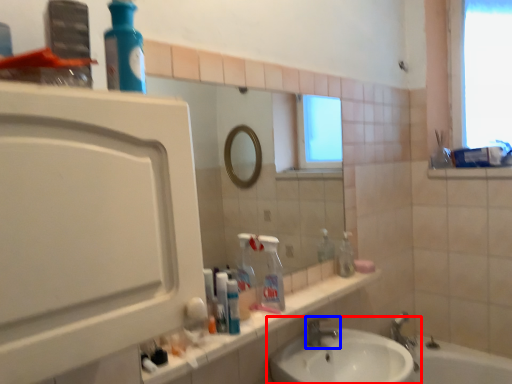
Question: Which of the following is the closest to the observer, sink (highlighted by a red box) or tap (highlighted by a blue box)?

Choices:
 (A) sink
 (B) tap

Answer: (A)